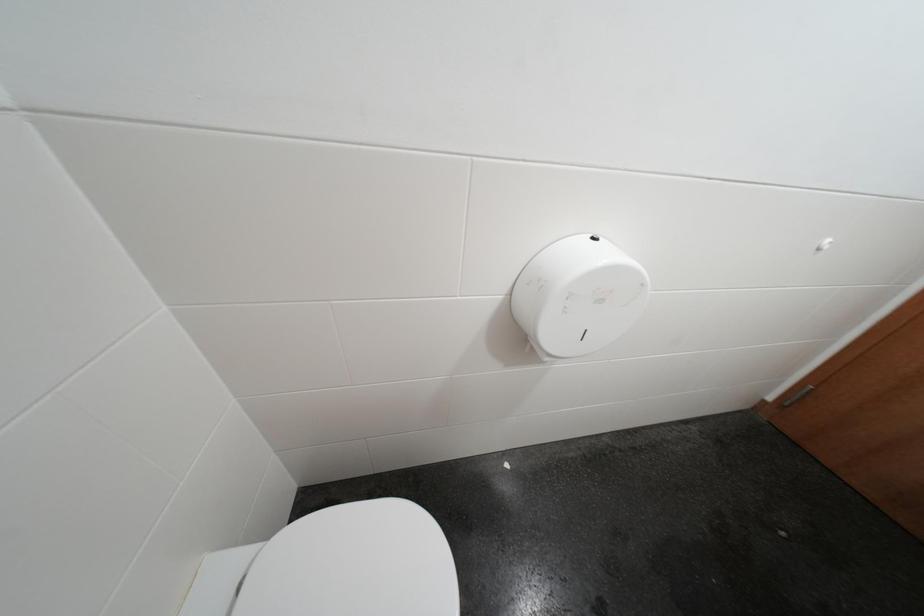
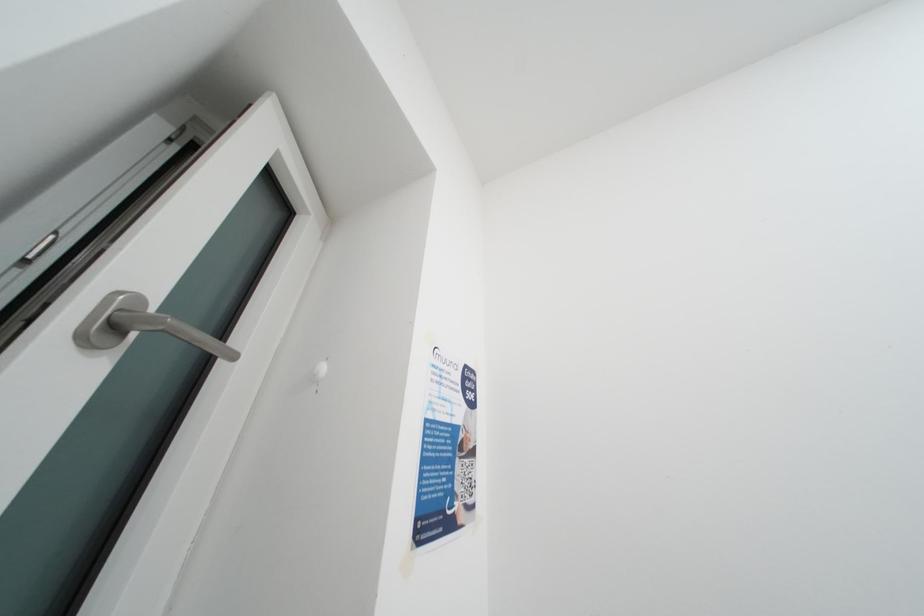
The first image is from the beginning of the video and the second image is from the end. How did the camera likely rotate when shooting the video?

The rotation direction of the camera is left-up.